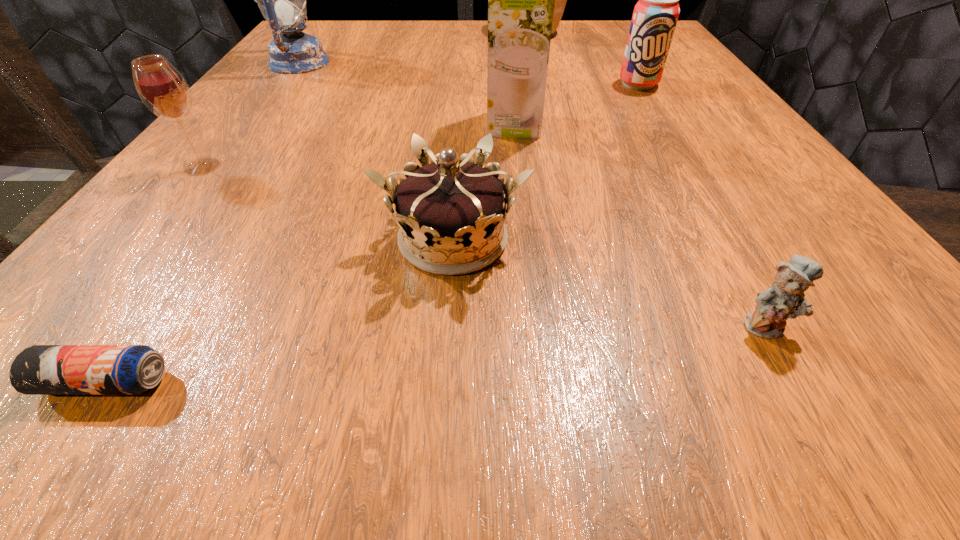
Identify the location of pitcher. This screenshot has height=540, width=960. 560,0.

You are a GUI agent. You are given a task and a screenshot of the screen. Output one action in this format:
    pyautogui.click(x=<x>, y=<y>)
    Task: Click on the lantern
    Image resolution: width=960 pixels, height=540 pixels.
    Given the screenshot: What is the action you would take?
    pyautogui.click(x=282, y=0)

This screenshot has width=960, height=540. I want to click on soya milk, so click(521, 0).

At what (x,y) coordinates should I click in order to perform the action: click on the fourth nearest object. Please return your answer as a coordinate pair (x, y). Looking at the image, I should click on (163, 90).

You are a GUI agent. You are given a task and a screenshot of the screen. Output one action in this format:
    pyautogui.click(x=<x>, y=<y>)
    Task: Click on the soda can
    The width and height of the screenshot is (960, 540).
    Given the screenshot: What is the action you would take?
    click(x=655, y=15)

Where is `the sixth farthest object`? Image resolution: width=960 pixels, height=540 pixels. the sixth farthest object is located at coordinates (x=454, y=207).

In order to click on the sixth tallest object in this screenshot , I will do `click(454, 207)`.

Locate an element on the screen. Image resolution: width=960 pixels, height=540 pixels. the second nearest object is located at coordinates (784, 299).

Locate an element on the screen. The image size is (960, 540). teddy bear is located at coordinates (784, 299).

Where is `the nearest object`? Image resolution: width=960 pixels, height=540 pixels. the nearest object is located at coordinates (40, 369).